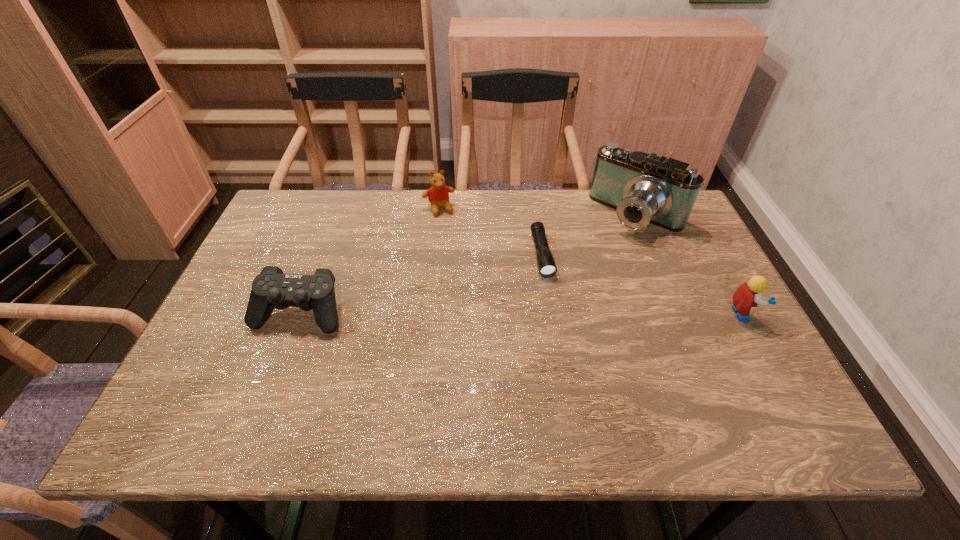
You are a GUI agent. You are given a task and a screenshot of the screen. Output one action in this format:
    pyautogui.click(x=<x>, y=<y>)
    Task: Click on the vacant space located at the lens end of the third object from left to right
    The height and width of the screenshot is (540, 960).
    Given the screenshot: What is the action you would take?
    pyautogui.click(x=563, y=343)

Find the location of a particular element. This screenshot has height=540, width=960. free point located on the front-facing side of the second object from left to right is located at coordinates (463, 261).

Locate an element on the screen. The height and width of the screenshot is (540, 960). free space located 0.100m on the front-facing side of the second object from left to right is located at coordinates (452, 237).

Where is `vacant region located on the front-facing side of the second object from left to right`? vacant region located on the front-facing side of the second object from left to right is located at coordinates (455, 244).

Where is `vacant space located 0.400m on the front-facing side of the camcorder`? vacant space located 0.400m on the front-facing side of the camcorder is located at coordinates (546, 322).

Find the location of `free point located on the front-facing side of the camcorder`. free point located on the front-facing side of the camcorder is located at coordinates (557, 310).

This screenshot has width=960, height=540. In order to click on free point located on the front-facing side of the camcorder in this screenshot , I will do `click(560, 307)`.

Where is `flashlight present at the far edge`? Image resolution: width=960 pixels, height=540 pixels. flashlight present at the far edge is located at coordinates (547, 268).

The image size is (960, 540). What are the coordinates of `teddy bear present at the far edge` in the screenshot? It's located at (438, 194).

Find the location of `camcorder present at the far edge`. camcorder present at the far edge is located at coordinates (643, 188).